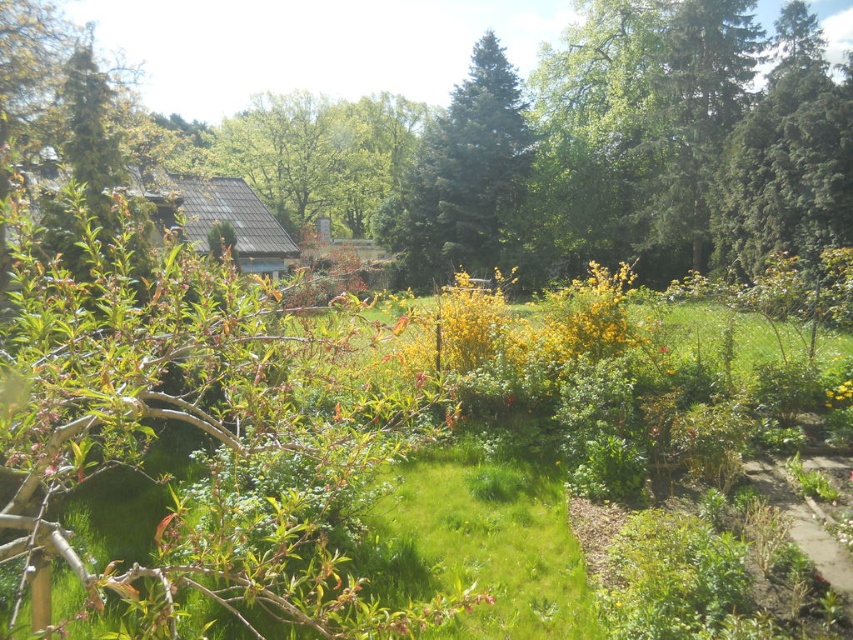
Question: Does green grass at center have a larger size compared to yellow matte flower at lower right?

Choices:
 (A) yes
 (B) no

Answer: (A)

Question: From the image, what is the correct spatial relationship of green textured pine tree at center in relation to yellow matte flowers at center?

Choices:
 (A) left
 (B) right

Answer: (A)

Question: Which point is closer to the camera?

Choices:
 (A) yellow matte flower at lower right
 (B) green grass at center
 (C) dirt path at lower right
 (D) green textured tree at upper right

Answer: (B)

Question: Which object is positioned farthest from the green textured pine tree at center?

Choices:
 (A) green textured tree at upper right
 (B) dirt path at lower right

Answer: (B)

Question: Is the position of green textured tree at upper right less distant than that of dirt path at lower right?

Choices:
 (A) yes
 (B) no

Answer: (B)

Question: Which point is closer to the camera?

Choices:
 (A) (160, 605)
 (B) (450, 323)

Answer: (A)